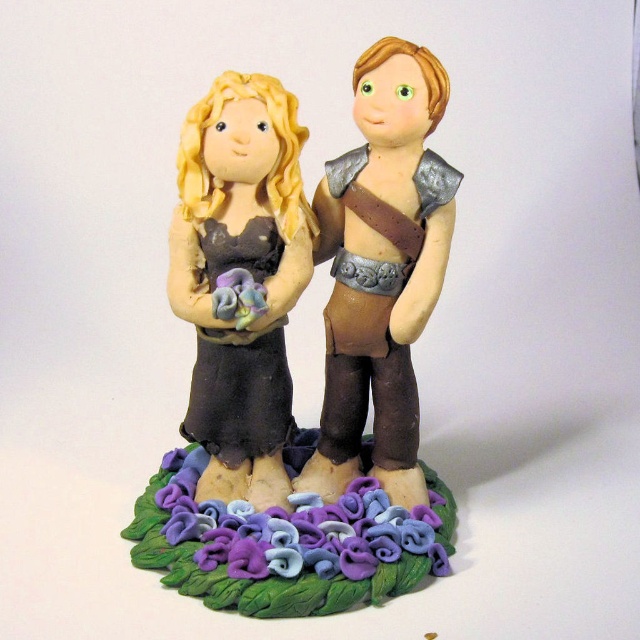
Consider the image. Who is taller, matte brown figurine at center or purple clay flowers at center?

Standing taller between the two is matte brown figurine at center.

Is point (412, 323) positioned in front of point (172, 580)?

That is False.

The height and width of the screenshot is (640, 640). I want to click on matte brown figurine at center, so click(284, 355).

Between matte brown dress at center and purple clay flowers at center, which one is positioned lower?

purple clay flowers at center is below.

Does matte brown dress at center have a lesser height compared to purple clay flowers at center?

No.

Locate an element on the screen. The width and height of the screenshot is (640, 640). matte brown dress at center is located at coordinates (241, 278).

Can you confirm if brown leather armor at center is positioned to the right of purple clay flowers at center?

Correct, you'll find brown leather armor at center to the right of purple clay flowers at center.

Can you confirm if brown leather armor at center is positioned to the left of purple clay flowers at center?

Incorrect, brown leather armor at center is not on the left side of purple clay flowers at center.

What do you see at coordinates (381, 269) in the screenshot? I see `brown leather armor at center` at bounding box center [381, 269].

Locate an element on the screen. brown leather armor at center is located at coordinates (381, 269).